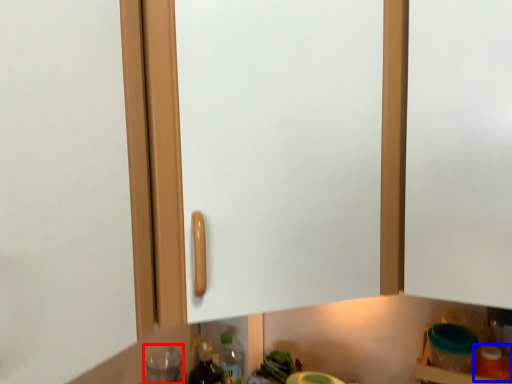
Question: Which of the following is the farthest to the observer, bottle (highlighted by a red box) or bottle (highlighted by a blue box)?

Choices:
 (A) bottle
 (B) bottle

Answer: (A)